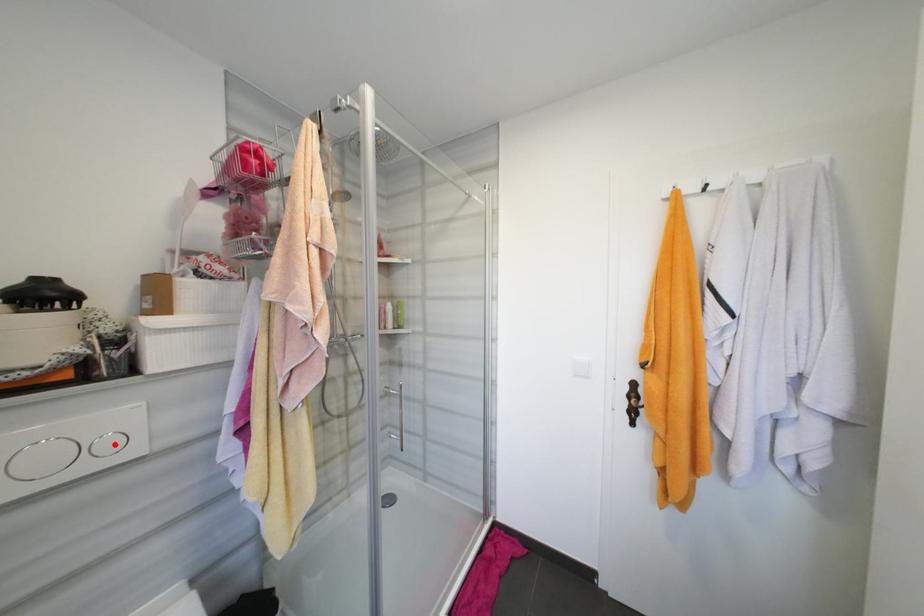
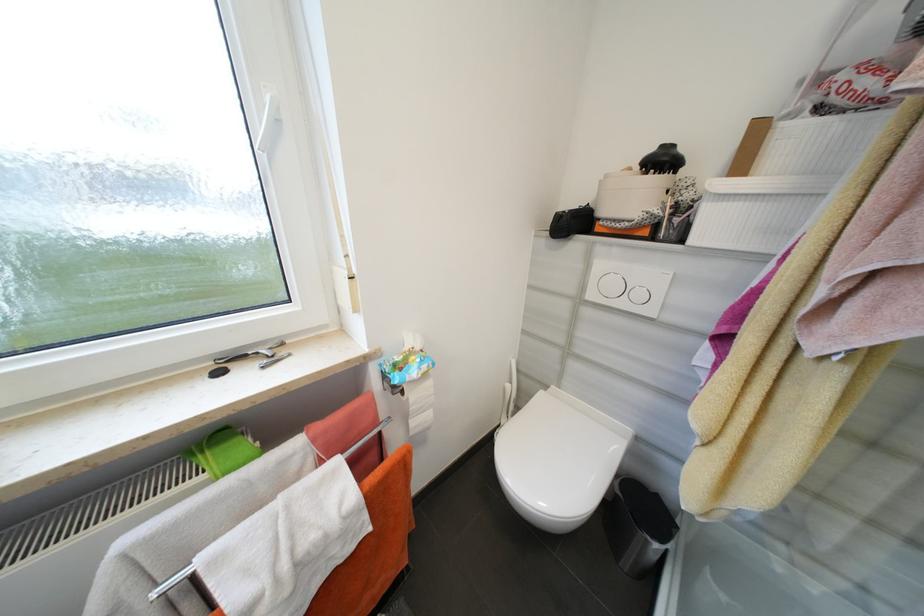
Locate, in the second image, the point that corresponds to the highlighted location in the first image.

(646, 296)